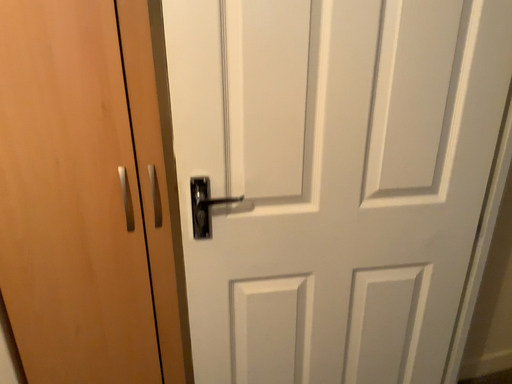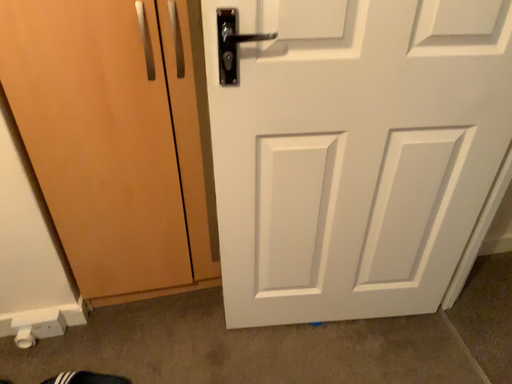
Question: How did the camera likely rotate when shooting the video?

Choices:
 (A) rotated downward
 (B) rotated upward

Answer: (A)